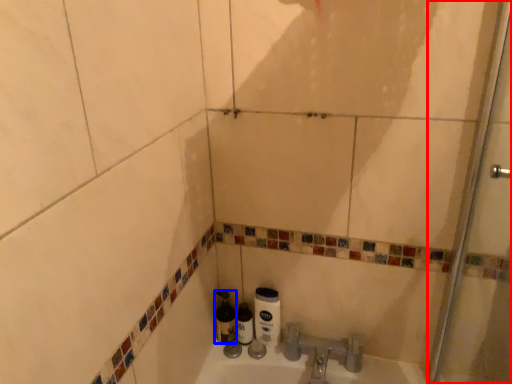
Question: Which object appears closest to the camera in this image, shower door (highlighted by a red box) or bottle (highlighted by a blue box)?

Choices:
 (A) shower door
 (B) bottle

Answer: (A)